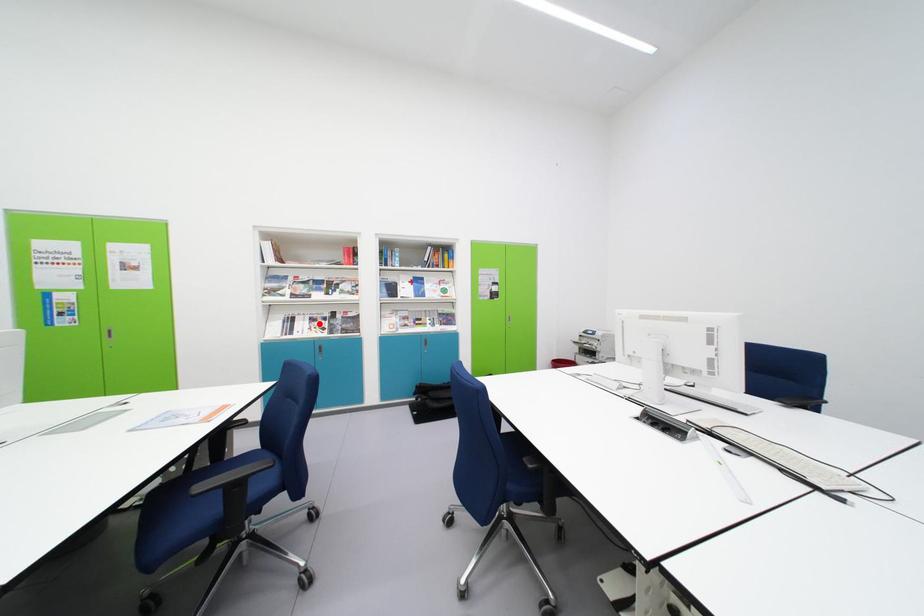
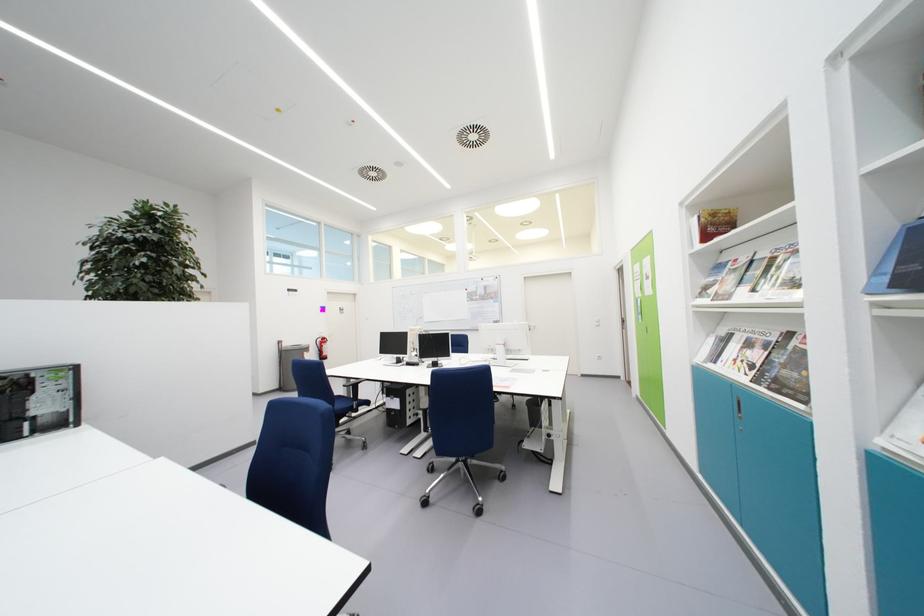
The point at the highlighted location is marked in the first image. Where is the corresponding point in the second image?

(755, 349)